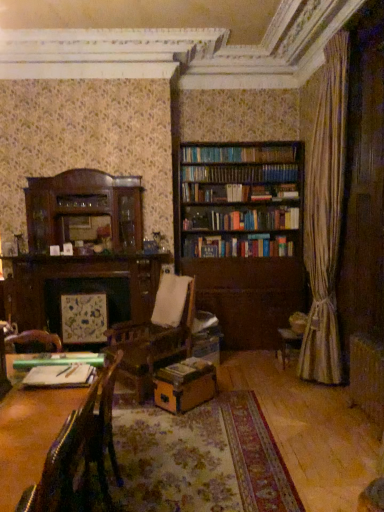
Where is `free space above wooden book at center, which appears as the 1th book when viewed from the back (from a real-world perspective)`? free space above wooden book at center, which appears as the 1th book when viewed from the back (from a real-world perspective) is located at coordinates (181, 366).